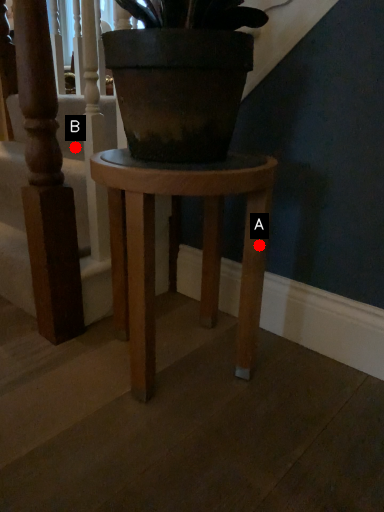
Question: Two points are circled on the image, labeled by A and B beside each circle. Which point appears closest to the camera in this image?

Choices:
 (A) A is closer
 (B) B is closer

Answer: (A)